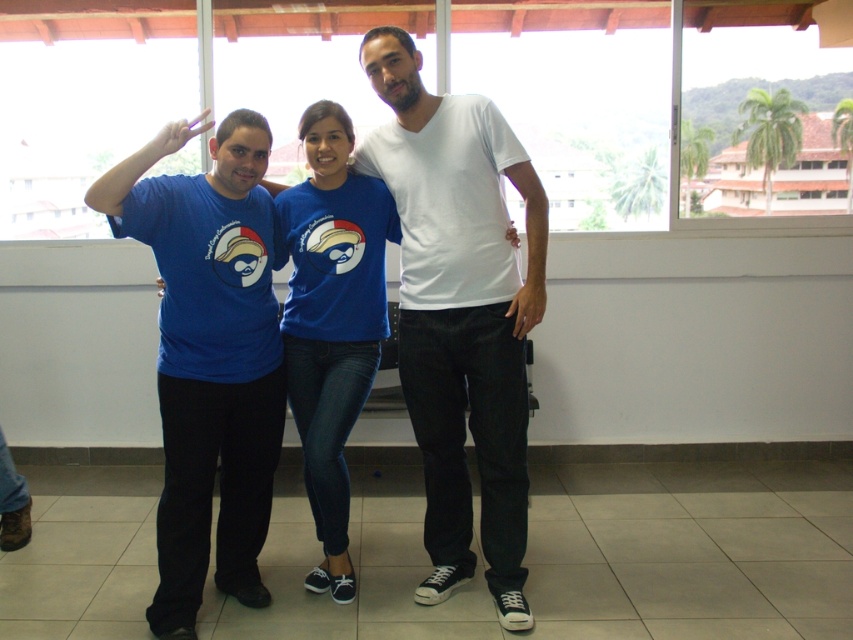
Is the position of white matte t-shirt at center more distant than that of matte blue t-shirt at left?

Yes, white matte t-shirt at center is further from the viewer.

Does white matte t-shirt at center appear under matte blue t-shirt at left?

Actually, white matte t-shirt at center is above matte blue t-shirt at left.

Which is behind, point (453, 129) or point (227, 467)?

Point (227, 467)

Identify the location of white matte t-shirt at center. This screenshot has height=640, width=853. (460, 314).

Is point (439, 234) in front of point (367, 179)?

That is True.

Who is lower down, white matte t-shirt at center or blue cotton shirt at center?

blue cotton shirt at center is lower down.

Which is behind, point (468, 493) or point (287, 193)?

Positioned behind is point (468, 493).

I want to click on white matte t-shirt at center, so click(460, 314).

Is matte blue t-shirt at left behind blue cotton shirt at center?

No, it is not.

Between matte blue t-shirt at left and blue cotton shirt at center, which one is positioned higher?

blue cotton shirt at center

At what (x,y) coordinates should I click in order to perform the action: click on matte blue t-shirt at left. Please return your answer as a coordinate pair (x, y). Looking at the image, I should click on (207, 355).

At what (x,y) coordinates should I click in order to perform the action: click on matte blue t-shirt at left. Please return your answer as a coordinate pair (x, y). Looking at the image, I should click on (207, 355).